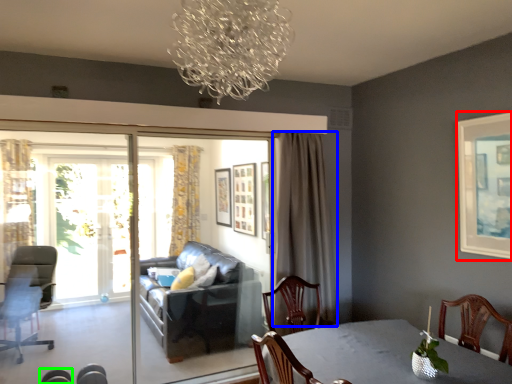
Question: Which object is positioned closest to picture frame (highlighted by a red box)? Select from curtain (highlighted by a blue box) and chair (highlighted by a green box).

Choices:
 (A) curtain
 (B) chair

Answer: (A)